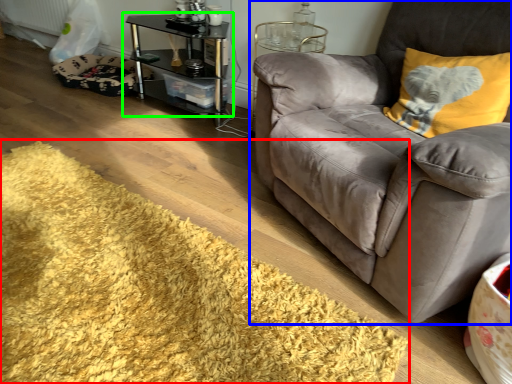
Question: Considering the real-world distances, which object is farthest from mat (highlighted by a red box)? studio couch (highlighted by a blue box) or table (highlighted by a green box)?

Choices:
 (A) studio couch
 (B) table

Answer: (B)